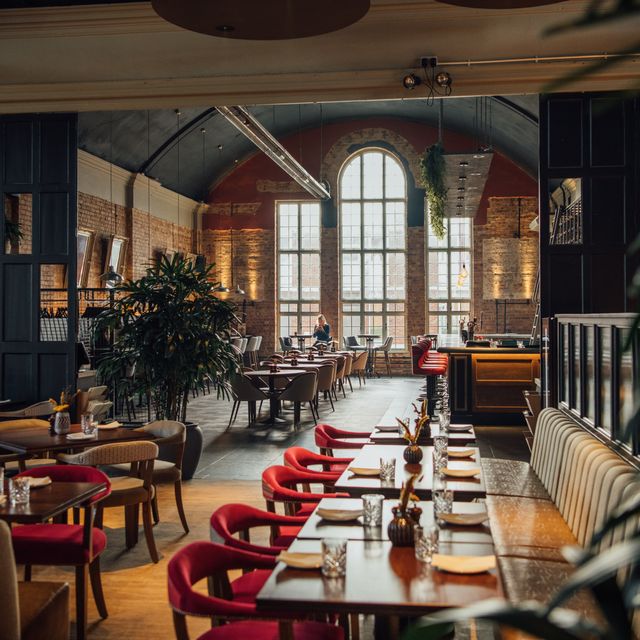
Image resolution: width=640 pixels, height=640 pixels. Find the location of `wood floor`. wood floor is located at coordinates (136, 609).